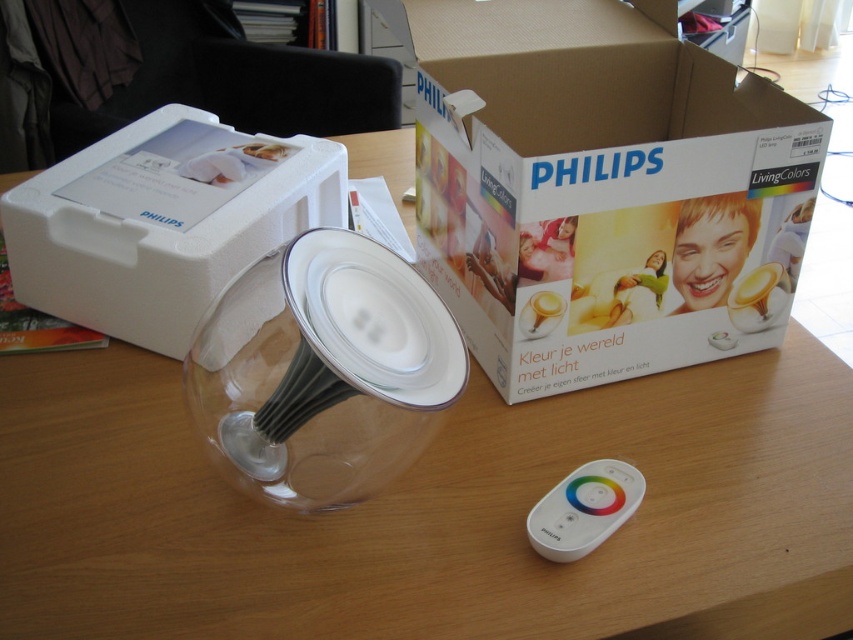
You are trying to determine which box is taller between the white cardboard box at center and the white foam box at upper left. Based on the scene, which one is taller?

The white cardboard box at center is taller than the white foam box at upper left according to the description.

You are setting up the Philips LivingColors LED lamp and need to place both the white foam box at upper left and the white plastic remote control at lower center on a shelf. The shelf has a height limit of 15 cm. Given their heights, will both items fit on the shelf without exceeding the height limit?

The white foam box at upper left has a greater height compared to the white plastic remote control at lower center. Since the shelf has a height limit of 15 cm, both items can only fit if their individual heights are under this limit. However, without specific measurements, it is impossible to determine if they exceed the limit. Please check the exact heights of both items.